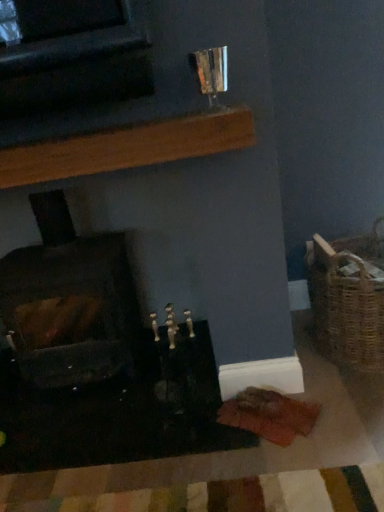
At what (x,y) coordinates should I click in order to perform the action: click on free space above wooden plank at upper center (from a real-world perspective). Please return your answer as a coordinate pair (x, y). The width and height of the screenshot is (384, 512). Looking at the image, I should click on (90, 136).